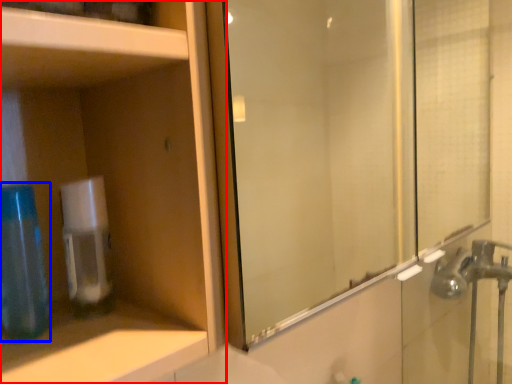
Question: Among these objects, which one is farthest to the camera, cabinetry (highlighted by a red box) or mouthwash (highlighted by a blue box)?

Choices:
 (A) cabinetry
 (B) mouthwash

Answer: (B)